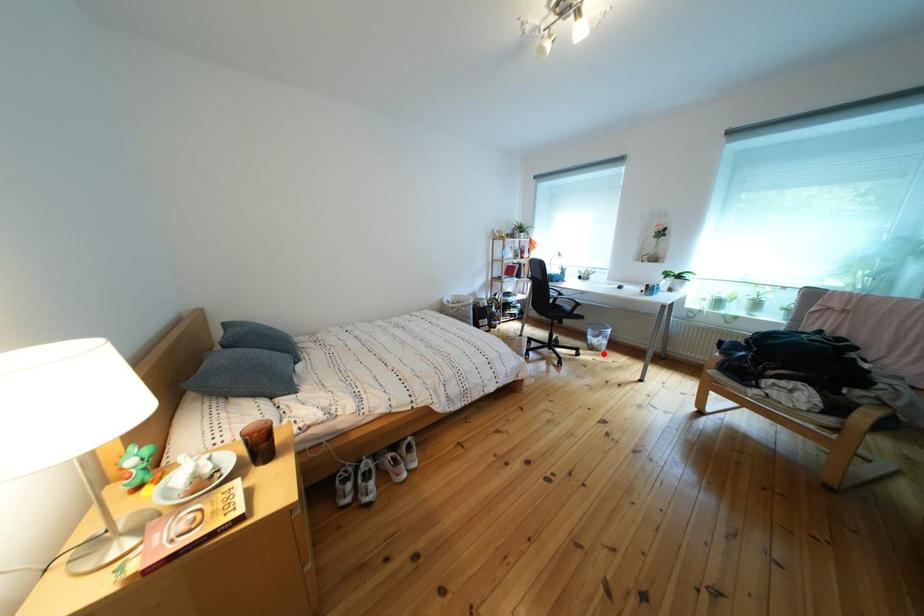
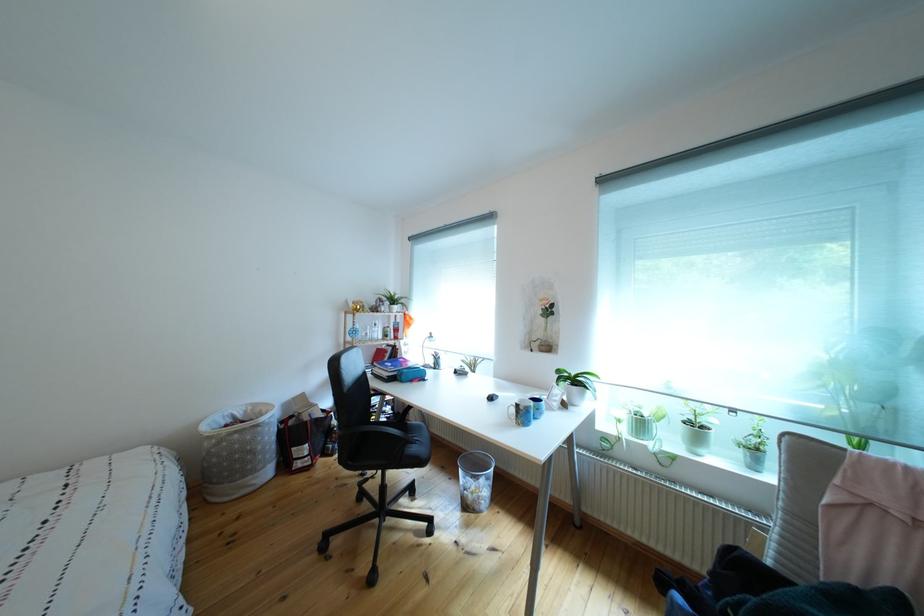
In the second image, find the point that corresponds to the highlighted location in the first image.

(477, 512)